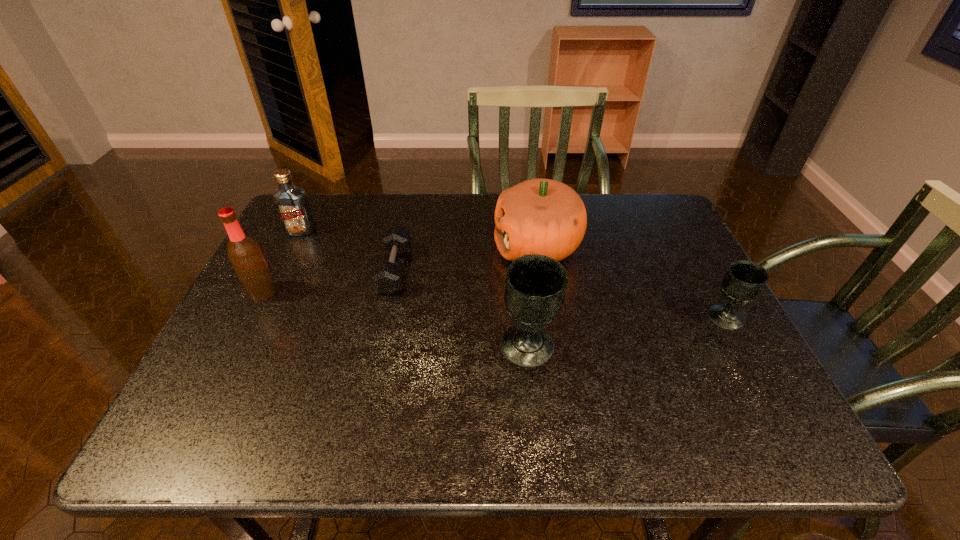
Considering the uniform spacing of chalices, where should an additional chalice be positioned on the left? Please locate a free spot. Please provide its 2D coordinates. Your answer should be formatted as a tuple, i.e. [(x, y)], where the tuple contains the x and y coordinates of a point satisfying the conditions above.

[(303, 379)]